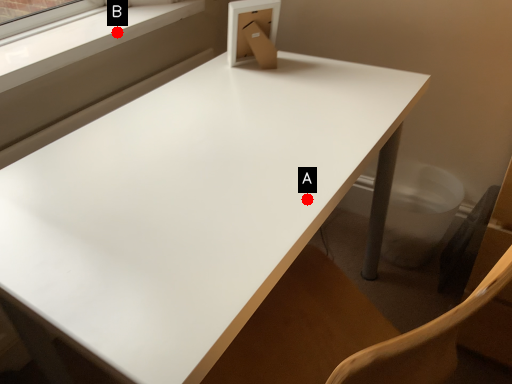
Question: Two points are circled on the image, labeled by A and B beside each circle. Which point is closer to the camera?

Choices:
 (A) A is closer
 (B) B is closer

Answer: (A)